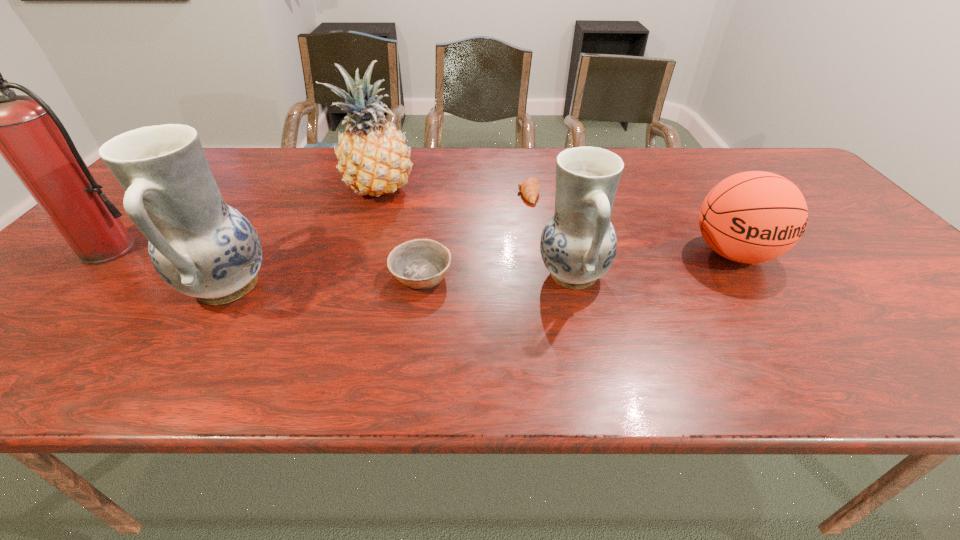
In the current image, all potterys are evenly spaced. To maintain this equal spacing, where should an additional pottery be placed on the right? Please point out a free spot. Please provide its 2D coordinates. Your answer should be formatted as a tuple, i.e. [(x, y)], where the tuple contains the x and y coordinates of a point satisfying the conditions above.

[(900, 264)]